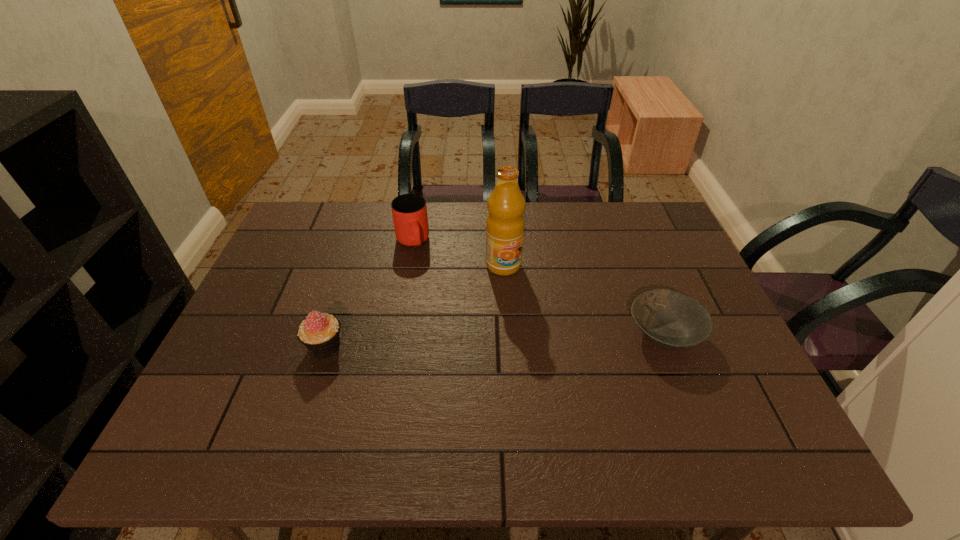
Locate an element on the screen. This screenshot has width=960, height=540. vacant spot on the desktop that is between the leftmost object and the shortest object and is positioned on the handle side of the cup is located at coordinates (448, 342).

Where is `vacant spot on the desktop that is between the cupcake and the bowl and is positioned on the front label of the second object from right to left`? This screenshot has width=960, height=540. vacant spot on the desktop that is between the cupcake and the bowl and is positioned on the front label of the second object from right to left is located at coordinates (544, 338).